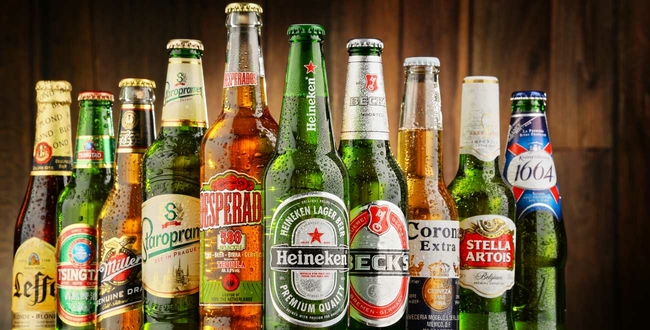
Where is `beer bottles`? This screenshot has width=650, height=330. beer bottles is located at coordinates (34, 249), (72, 226), (120, 242), (161, 251), (228, 253), (281, 259), (367, 242), (434, 257), (482, 263), (534, 277).